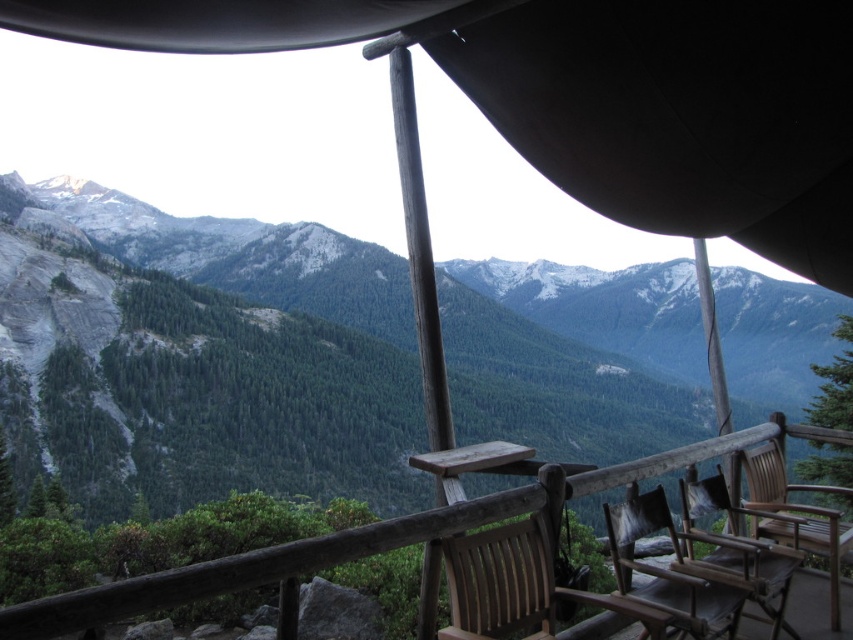
Question: Is wooden textured chair at center to the right of wooden chair at lower right from the viewer's perspective?

Choices:
 (A) no
 (B) yes

Answer: (A)

Question: Which point is closer to the camera?

Choices:
 (A) green textured forest at center
 (B) wooden textured chair at center
 (C) wooden chair at right

Answer: (B)

Question: Which point is farther from the camera taking this photo?

Choices:
 (A) (682, 490)
 (B) (398, 484)
 (C) (631, 544)

Answer: (B)

Question: In this image, where is green textured forest at center located relative to wooden textured chair at center?

Choices:
 (A) right
 (B) left

Answer: (B)

Question: Does wooden textured chair at center appear over wooden chair at right?

Choices:
 (A) no
 (B) yes

Answer: (A)

Question: Which point is closer to the camera?

Choices:
 (A) (258, 324)
 (B) (712, 484)

Answer: (B)